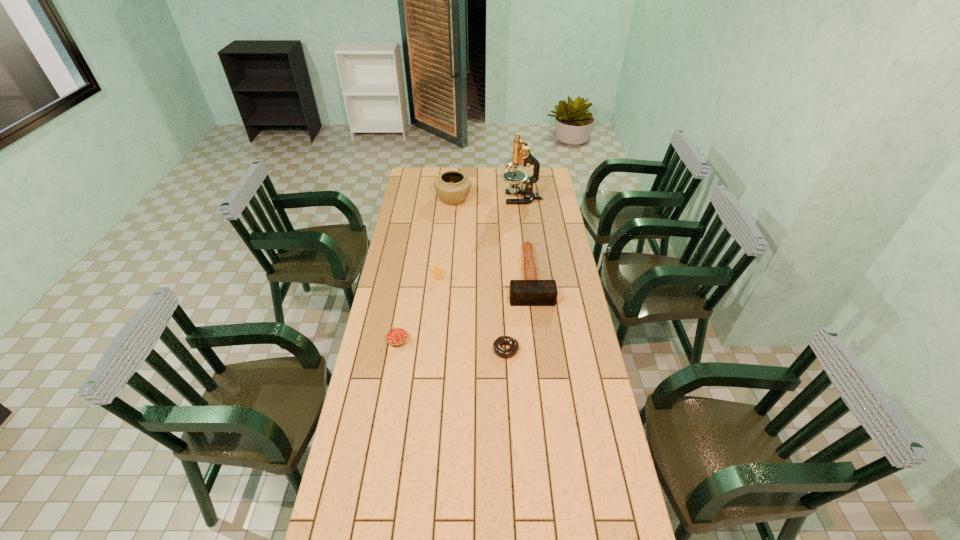
Identify the location of microscope. (521, 154).

Locate an element on the screen. This screenshot has width=960, height=540. the second tallest object is located at coordinates [452, 187].

You are a GUI agent. You are given a task and a screenshot of the screen. Output one action in this format:
    pyautogui.click(x=<x>, y=<y>)
    Task: Click on the Lego
    
    Given the screenshot: What is the action you would take?
    pyautogui.click(x=437, y=271)

The height and width of the screenshot is (540, 960). Find the location of `mallet`. mallet is located at coordinates (530, 292).

Where is `the leftmost object`? The height and width of the screenshot is (540, 960). the leftmost object is located at coordinates (396, 337).

Image resolution: width=960 pixels, height=540 pixels. Identify the location of strawberry. (396, 337).

Where is `doughnut`? The height and width of the screenshot is (540, 960). doughnut is located at coordinates (x=512, y=342).

Find the location of a particular element. free space located 0.300m at the eyepiece of the tallest object is located at coordinates (448, 198).

Find the location of `vacant space located 0.070m at the eyepiece of the tallest object`. vacant space located 0.070m at the eyepiece of the tallest object is located at coordinates (489, 198).

The width and height of the screenshot is (960, 540). In order to click on vacant space situated 0.050m at the eyepiece of the tallest object in this screenshot , I will do `click(492, 198)`.